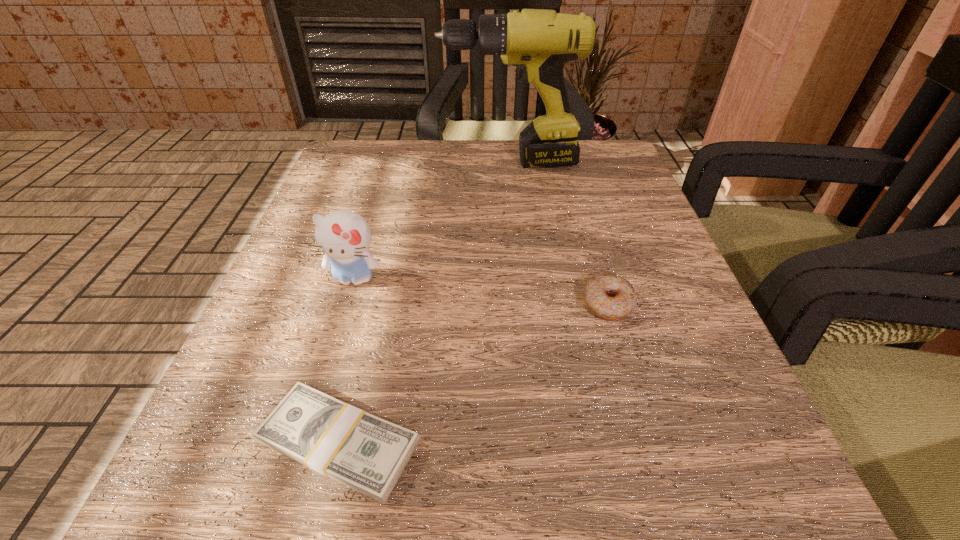
Find the location of a particular element. This screenshot has height=540, width=960. the farthest object is located at coordinates (539, 42).

Find the location of `drill`. drill is located at coordinates (539, 42).

The width and height of the screenshot is (960, 540). Identify the location of the third shortest object. (344, 236).

I want to click on the third tallest object, so click(609, 296).

You are a GUI agent. You are given a task and a screenshot of the screen. Output one action in this format:
    pyautogui.click(x=<x>, y=<y>)
    Task: Click on the nearest object
    
    Given the screenshot: What is the action you would take?
    pyautogui.click(x=368, y=454)

Locate an element on the screen. This screenshot has width=960, height=540. the shortest object is located at coordinates (368, 454).

Locate an element on the screen. blank area located on the handle side of the drill is located at coordinates (396, 162).

Locate an element on the screen. The height and width of the screenshot is (540, 960). vacant region located 0.220m on the handle side of the drill is located at coordinates (342, 162).

This screenshot has width=960, height=540. I want to click on vacant space situated on the handle side of the drill, so (333, 162).

You are a GUI agent. You are given a task and a screenshot of the screen. Output one action in this format:
    pyautogui.click(x=<x>, y=<y>)
    Task: Click on the free space located on the front-facing side of the second tallest object
    
    Given the screenshot: What is the action you would take?
    pyautogui.click(x=324, y=373)